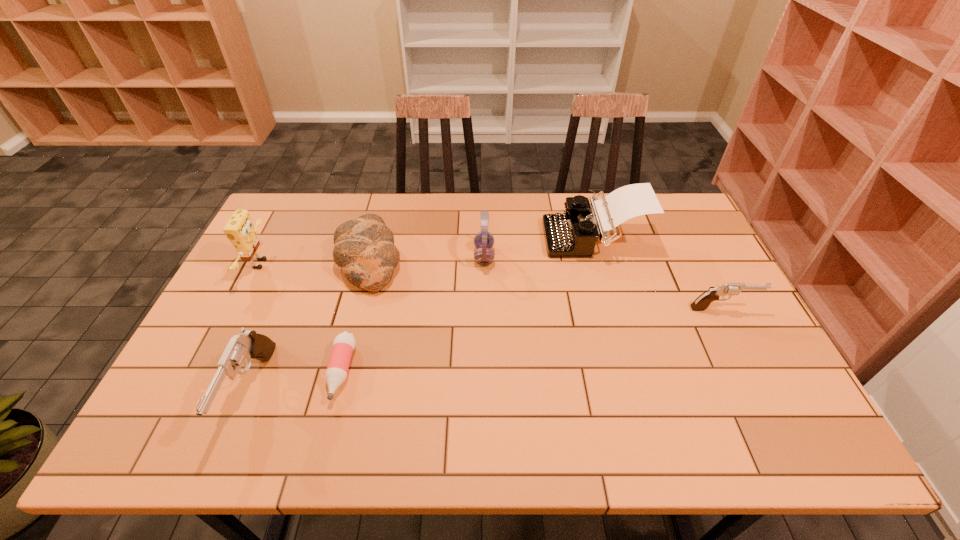
If equal spacing is the goal by inserting an additional gun among them, please point out a vacant space for this new gun. Please provide its 2D coordinates. Your answer should be formatted as a tuple, i.e. [(x, y)], where the tuple contains the x and y coordinates of a point satisfying the conditions above.

[(506, 347)]